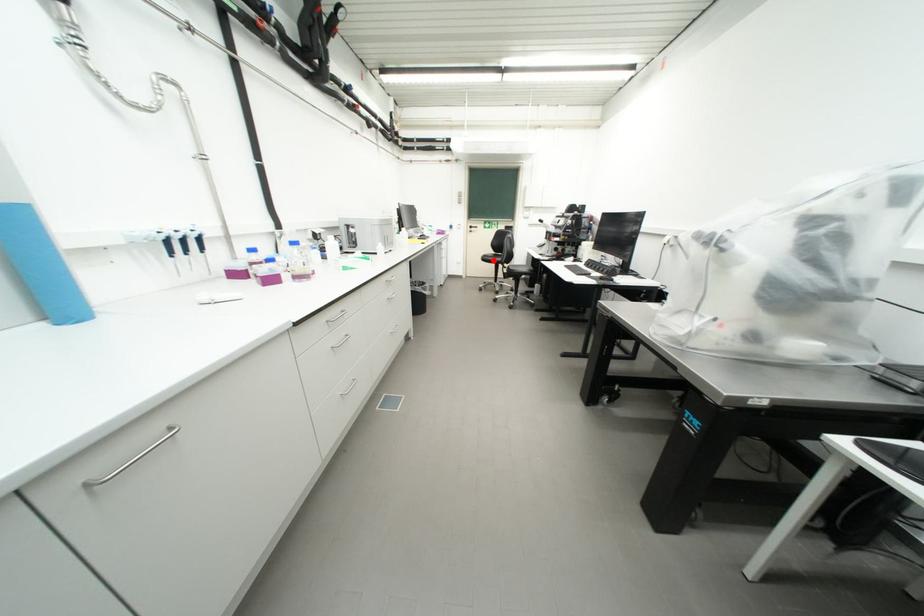
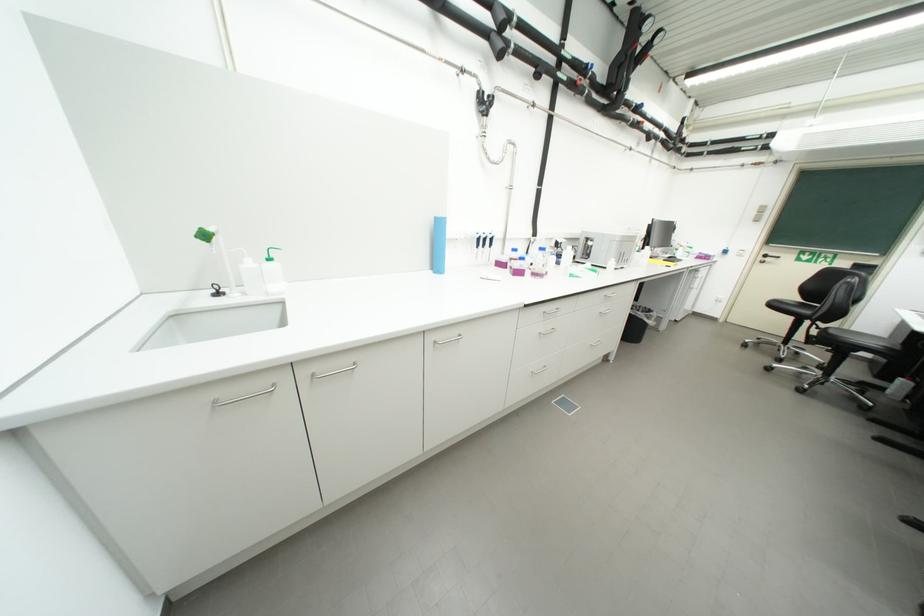
Question: A red point is marked in image1. In image2, is the corresponding 3D point closer to the camera or farther? Reply with the corresponding letter.

Choices:
 (A) The corresponding 3D point is closer.
 (B) The corresponding 3D point is farther.

Answer: (B)